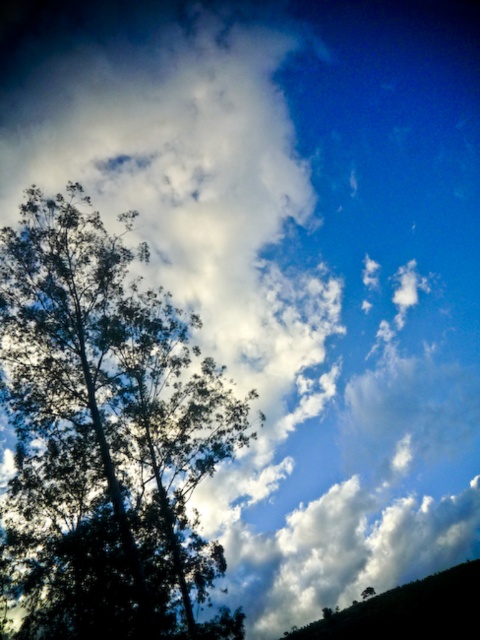
Who is positioned more to the right, dark green leafy tree at left or dark green textured hillside at lower right?

From the viewer's perspective, dark green textured hillside at lower right appears more on the right side.

You are a GUI agent. You are given a task and a screenshot of the screen. Output one action in this format:
    pyautogui.click(x=<x>, y=<y>)
    Task: Click on the dark green leafy tree at left
    
    Given the screenshot: What is the action you would take?
    pyautogui.click(x=105, y=436)